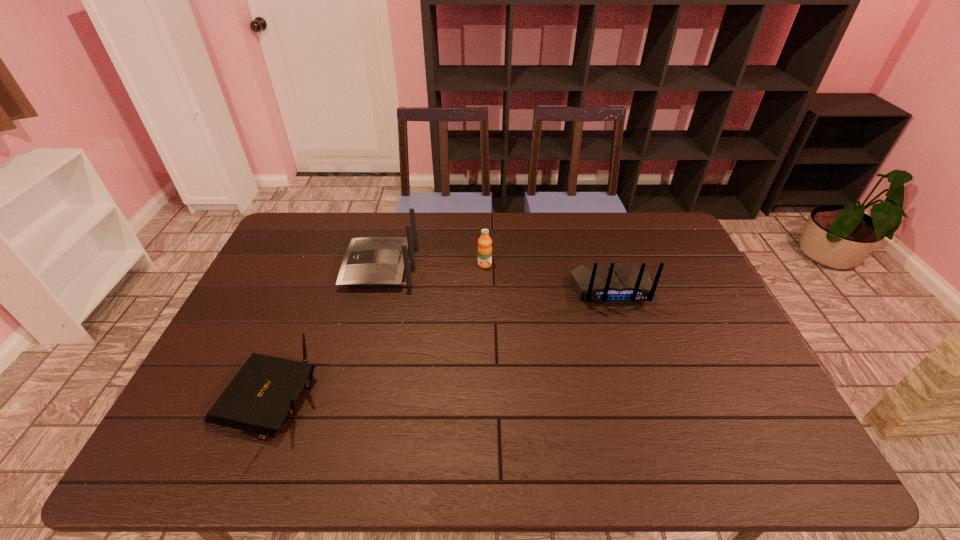
This screenshot has height=540, width=960. What are the coordinates of `object identified as the closest to the shortest router` in the screenshot? It's located at (369, 261).

Locate an element on the screen. Image resolution: width=960 pixels, height=540 pixels. object that ranks as the closest to the rightmost router is located at coordinates (484, 242).

Point out which router is positioned as the nearest to the shortest object. Please provide its 2D coordinates. Your answer should be formatted as a tuple, i.e. [(x, y)], where the tuple contains the x and y coordinates of a point satisfying the conditions above.

[(369, 261)]

I want to click on router that is the closest one to the rightmost object, so click(x=369, y=261).